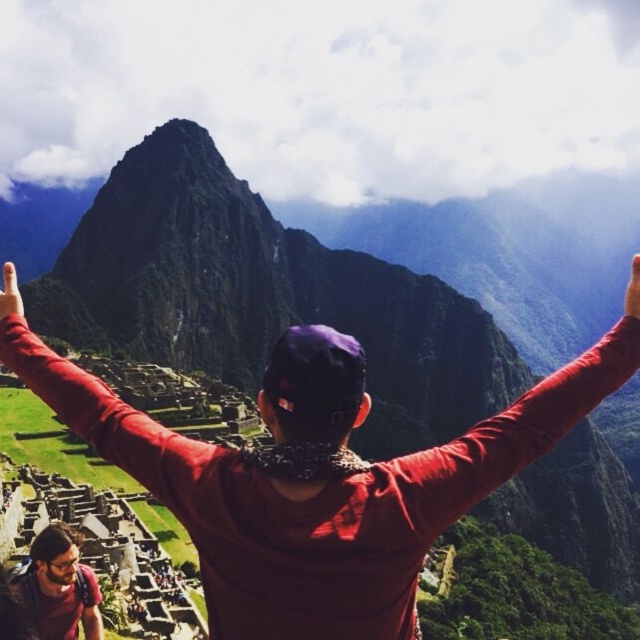
You are a photographer trying to capture the perfect shot of the matte red hand at upper left and the matte red finger at upper right. Which object should you focus on first to ensure both are in sharp focus?

You should focus on the matte red hand at upper left first because it is closer to you than the matte red finger at upper right, ensuring both will be in focus when focused on the closer object.

You are a photographer planning to capture a wide shot of Machu Picchu. You notice two red objects in the frame, the matte red hand at upper left and the matte red finger at upper right. Given that your camera has a maximum zoom range of 1000 feet, can you confirm whether these two objects will appear in the same frame without needing to adjust your position?

The matte red hand at upper left and matte red finger at upper right are 859.92 feet apart from each other. Since the camera has a maximum zoom range of 1000 feet, the distance between them is within the zoom capability. Therefore, both objects can be captured in the same frame without moving your position.